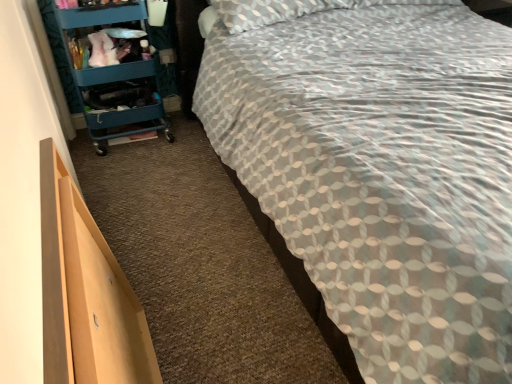
Image resolution: width=512 pixels, height=384 pixels. In order to click on patterned fabric bed at center in this screenshot , I will do `click(379, 168)`.

Where is `drawer that is behind the patterned fabric bed at center`? The image size is (512, 384). drawer that is behind the patterned fabric bed at center is located at coordinates (86, 293).

Can you tell me how much patterned fabric bed at center and light wood drawer at lower left differ in facing direction?

There is a 90.4-degree angle between the facing directions of patterned fabric bed at center and light wood drawer at lower left.

From a real-world perspective, is patterned fabric bed at center over light wood drawer at lower left?

Yes, from a real-world perspective, patterned fabric bed at center is on top of light wood drawer at lower left.

Do you think patterned fabric bed at center is within light wood drawer at lower left, or outside of it?

patterned fabric bed at center is spatially situated outside light wood drawer at lower left.

Is light wood drawer at lower left positioned with its back to teal plastic cart at left?

No, light wood drawer at lower left is not facing away from teal plastic cart at left.

From a real-world perspective, between light wood drawer at lower left and teal plastic cart at left, who is vertically higher?

From a 3D spatial view, teal plastic cart at left is above.

Identify the location of furniture that is behind the light wood drawer at lower left. pyautogui.click(x=108, y=70).

Between light wood drawer at lower left and teal plastic cart at left, which one has larger width?

teal plastic cart at left.

Does teal plastic cart at left come behind patterned fabric bed at center?

Yes.

Is teal plastic cart at left oriented away from patterned fabric bed at center?

No, teal plastic cart at left is not facing away from patterned fabric bed at center.

Can you confirm if teal plastic cart at left is bigger than patterned fabric bed at center?

No.

Is teal plastic cart at left turned away from light wood drawer at lower left?

No.

Are teal plastic cart at left and light wood drawer at lower left located far from each other?

Yes, teal plastic cart at left is far from light wood drawer at lower left.

From a real-world perspective, between teal plastic cart at left and light wood drawer at lower left, who is vertically lower?

light wood drawer at lower left is physically lower.

Considering the relative positions of patterned fabric bed at center and teal plastic cart at left in the image provided, is patterned fabric bed at center to the right of teal plastic cart at left from the viewer's perspective?

Correct, you'll find patterned fabric bed at center to the right of teal plastic cart at left.

How far apart are patterned fabric bed at center and teal plastic cart at left?

patterned fabric bed at center is 90.03 centimeters from teal plastic cart at left.

At what (x,y) coordinates should I click in order to perform the action: click on bed below the teal plastic cart at left (from the image's perspective). Please return your answer as a coordinate pair (x, y). This screenshot has height=384, width=512. Looking at the image, I should click on (379, 168).

Looking at this image, is patterned fabric bed at center inside the boundaries of teal plastic cart at left, or outside?

patterned fabric bed at center is not inside teal plastic cart at left, it's outside.

Is light wood drawer at lower left at the right side of patterned fabric bed at center?

In fact, light wood drawer at lower left is to the left of patterned fabric bed at center.

Is light wood drawer at lower left not within patterned fabric bed at center?

light wood drawer at lower left lies outside patterned fabric bed at center's area.

From the picture: Who is bigger, light wood drawer at lower left or patterned fabric bed at center?

Bigger between the two is patterned fabric bed at center.

Locate an element on the screen. drawer that is behind the patterned fabric bed at center is located at coordinates (86, 293).

Where is `drawer that appears below the teal plastic cart at left (from the image's perspective)`? This screenshot has height=384, width=512. drawer that appears below the teal plastic cart at left (from the image's perspective) is located at coordinates (86, 293).

Which object lies nearer to the anchor point teal plastic cart at left, patterned fabric bed at center or light wood drawer at lower left?

Among the two, patterned fabric bed at center is located nearer to teal plastic cart at left.

From the image, which object appears to be nearer to teal plastic cart at left, light wood drawer at lower left or patterned fabric bed at center?

patterned fabric bed at center.

Estimate the real-world distances between objects in this image. Which object is further from light wood drawer at lower left, patterned fabric bed at center or teal plastic cart at left?

teal plastic cart at left.

Consider the image. Considering their positions, is light wood drawer at lower left positioned closer to patterned fabric bed at center than teal plastic cart at left?

Among the two, light wood drawer at lower left is located nearer to patterned fabric bed at center.

From the image, which object appears to be nearer to light wood drawer at lower left, teal plastic cart at left or patterned fabric bed at center?

patterned fabric bed at center is closer to light wood drawer at lower left.

Which object lies further to the anchor point patterned fabric bed at center, teal plastic cart at left or light wood drawer at lower left?

Based on the image, teal plastic cart at left appears to be further to patterned fabric bed at center.

Where is `drawer between patterned fabric bed at center and teal plastic cart at left from front to back`? This screenshot has height=384, width=512. drawer between patterned fabric bed at center and teal plastic cart at left from front to back is located at coordinates (x=86, y=293).